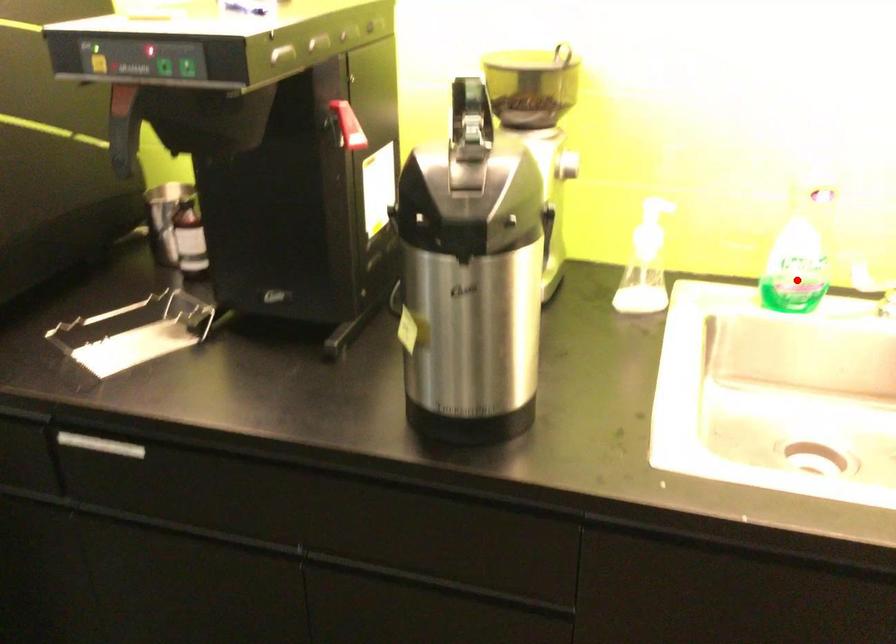
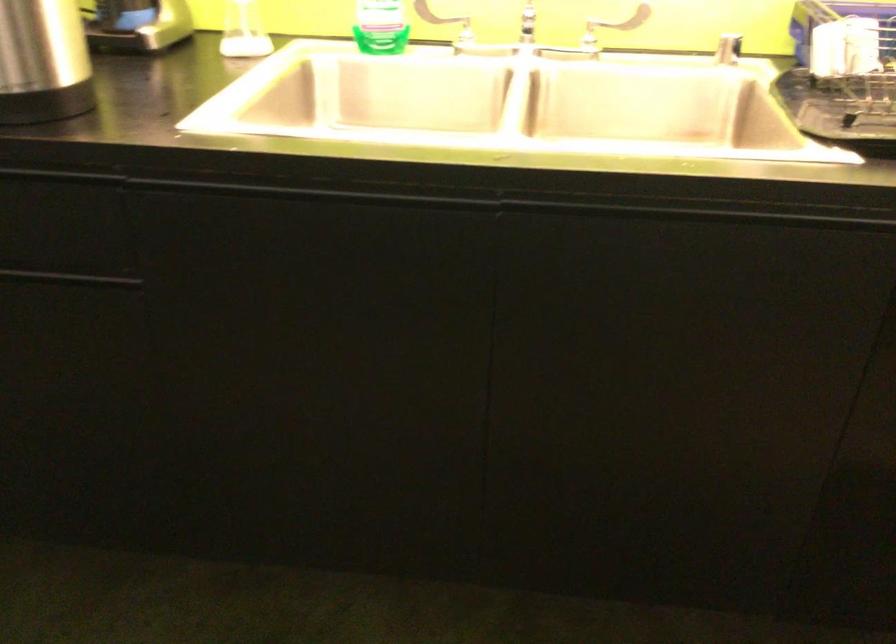
Question: I am providing you with two images of the same scene from different viewpoints. In image1, a red point is highlighted. Considering the same 3D point in image2, which of the following is correct?

Choices:
 (A) It is closer
 (B) It is farther

Answer: (B)